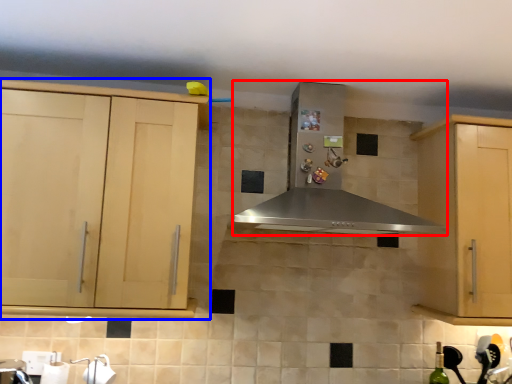
Question: Which object is further to the camera taking this photo, home appliance (highlighted by a red box) or cabinetry (highlighted by a blue box)?

Choices:
 (A) home appliance
 (B) cabinetry

Answer: (B)